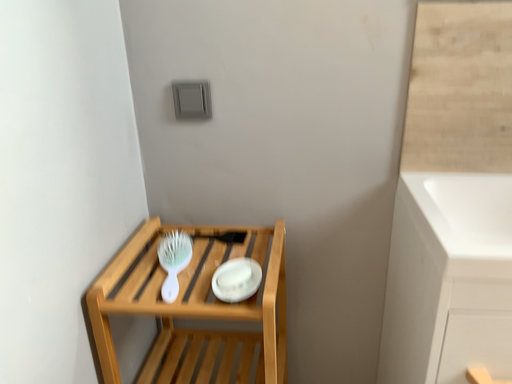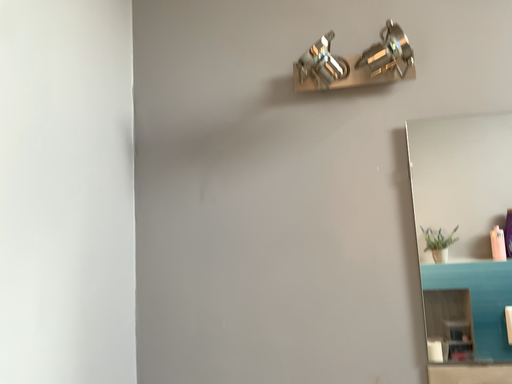
Question: Which way did the camera rotate in the video?

Choices:
 (A) rotated downward
 (B) rotated upward

Answer: (B)